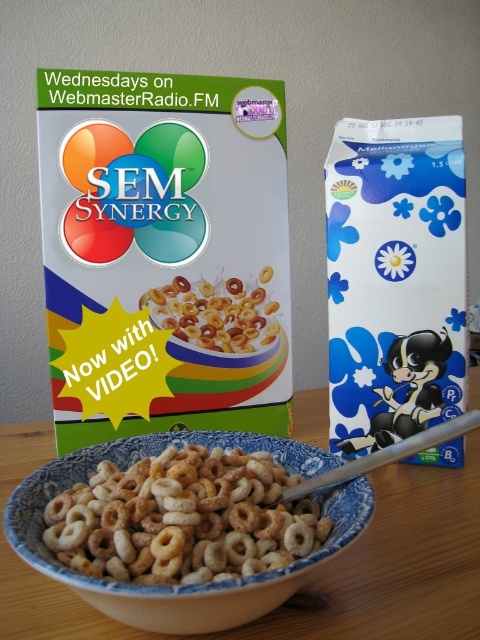
Question: Which object is positioned farthest from the blue ceramic bowl at center?

Choices:
 (A) blue glossy milk carton at right
 (B) matte cardboard cereal box at center

Answer: (A)

Question: Which object is the farthest from the matte cardboard cereal box at center?

Choices:
 (A) blue glossy milk carton at right
 (B) blue ceramic bowl at center
 (C) golden matte cereal rings at center

Answer: (B)

Question: Can you confirm if matte cardboard cereal box at center is positioned above golden matte cereal rings at center?

Choices:
 (A) no
 (B) yes

Answer: (B)

Question: Is blue glossy milk carton at right thinner than blue ceramic bowl at center?

Choices:
 (A) no
 (B) yes

Answer: (B)

Question: Does blue ceramic bowl at center come in front of golden matte cereal rings at center?

Choices:
 (A) yes
 (B) no

Answer: (A)

Question: Which of the following is the closest to the observer?

Choices:
 (A) golden matte cereal rings at center
 (B) blue ceramic bowl at center
 (C) matte cardboard cereal box at center
 (D) blue glossy milk carton at right

Answer: (B)